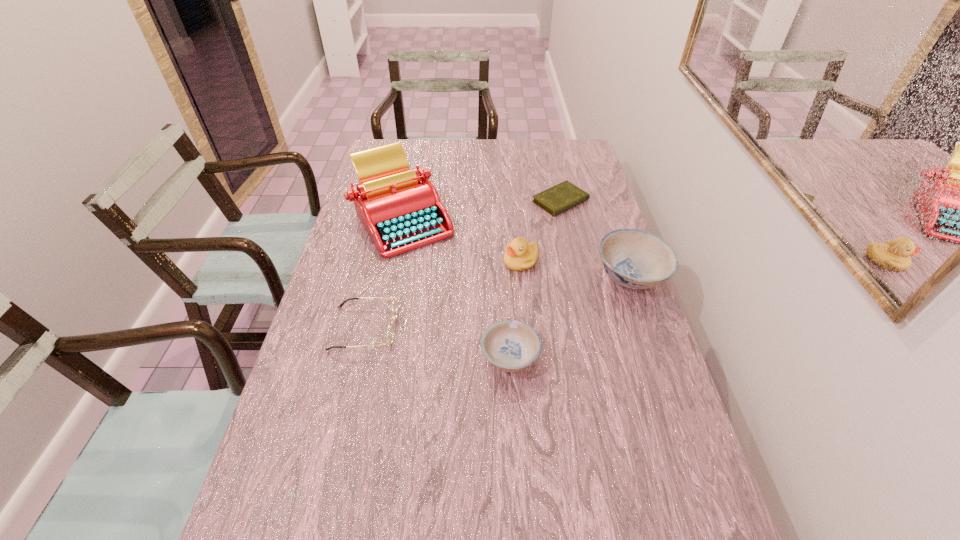
Where is `free space between the tallest object and the duckling`? This screenshot has width=960, height=540. free space between the tallest object and the duckling is located at coordinates (462, 240).

The image size is (960, 540). What are the coordinates of `unoccupied area between the tallest object and the duckling` in the screenshot? It's located at (462, 240).

The height and width of the screenshot is (540, 960). Identify the location of object that is the fourth nearest to the duckling. (510, 345).

Locate which object is the fourth closest to the tallest object. Please provide its 2D coordinates. Your answer should be formatted as a tuple, i.e. [(x, y)], where the tuple contains the x and y coordinates of a point satisfying the conditions above.

[(510, 345)]

Identify the location of free spot that satisfies the following two spatial constraints: 1. on the front-facing side of the duckling; 2. on the right side of the taller bowl. (522, 275).

Find the location of a particular element. The image size is (960, 540). free space that satisfies the following two spatial constraints: 1. on the front-facing side of the duckling; 2. on the right side of the right bowl is located at coordinates (522, 275).